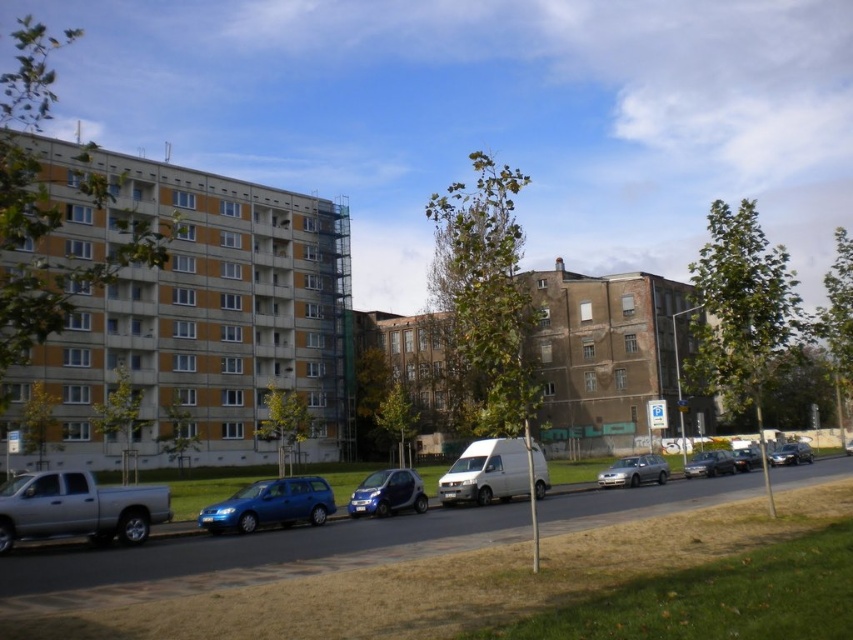
Does metallic blue car at center have a greater width compared to metallic silver sedan at center?

No.

Who is higher up, metallic blue car at center or metallic silver sedan at center?

Positioned higher is metallic blue car at center.

Does point (386, 483) come in front of point (720, 472)?

Yes, it is in front of point (720, 472).

Identify the location of metallic blue car at center. The width and height of the screenshot is (853, 640). (387, 493).

Can you confirm if satin blue station wagon at lower center is positioned to the right of metallic blue car at center?

In fact, satin blue station wagon at lower center is to the left of metallic blue car at center.

Between satin blue station wagon at lower center and metallic blue car at center, which one has less height?

With less height is metallic blue car at center.

The width and height of the screenshot is (853, 640). What are the coordinates of `satin blue station wagon at lower center` in the screenshot? It's located at (270, 506).

Based on the photo, does green grass at lower center appear over satin silver sedan at center?

Yes, green grass at lower center is above satin silver sedan at center.

Which of these two, green grass at lower center or satin silver sedan at center, stands taller?

satin silver sedan at center

Locate an element on the screen. The height and width of the screenshot is (640, 853). green grass at lower center is located at coordinates (479, 572).